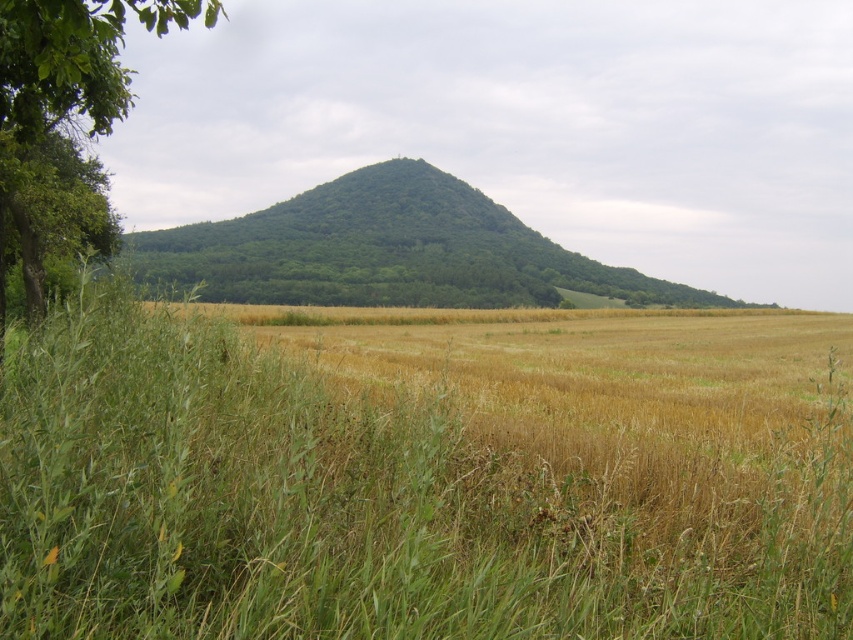
Image resolution: width=853 pixels, height=640 pixels. Describe the element at coordinates (424, 474) in the screenshot. I see `brown grassy field at center` at that location.

Is brown grassy field at center shorter than green leafy tree at left?

Yes.

I want to click on brown grassy field at center, so click(x=424, y=474).

Image resolution: width=853 pixels, height=640 pixels. Identify the location of brown grassy field at center. (424, 474).